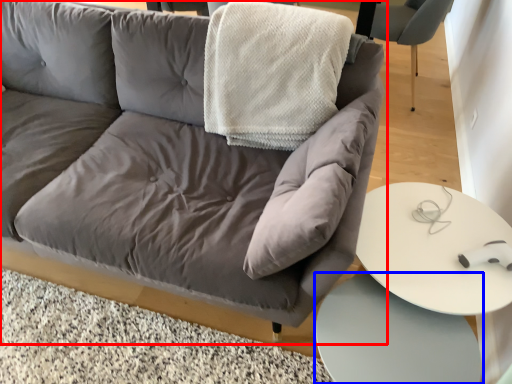
Question: Which object is further to the camera taking this photo, studio couch (highlighted by a red box) or table (highlighted by a blue box)?

Choices:
 (A) studio couch
 (B) table

Answer: (B)